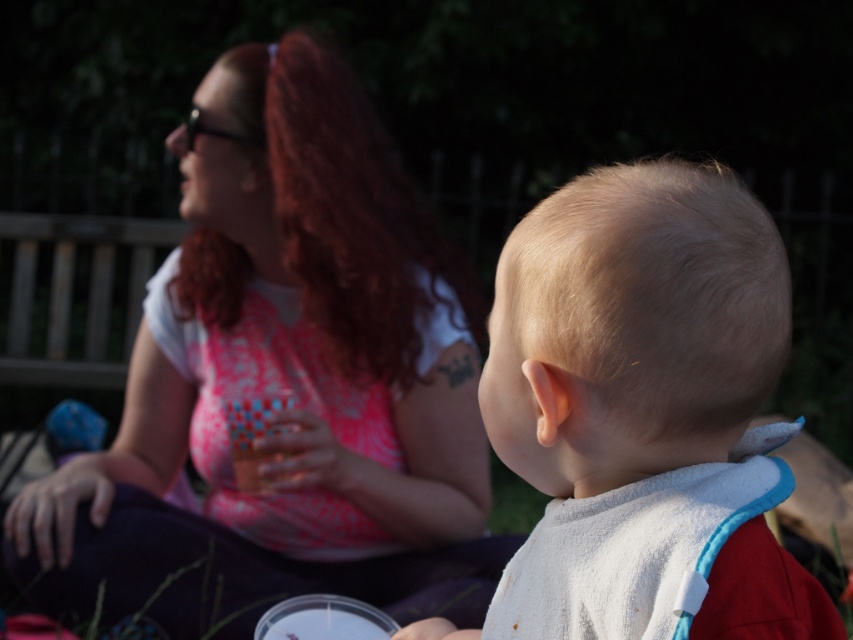
The image size is (853, 640). What do you see at coordinates (285, 381) in the screenshot?
I see `pink printed fabric at upper left` at bounding box center [285, 381].

Measure the distance between point (178, 602) and camera.

Point (178, 602) is 6.94 feet from camera.

Identify the location of pink printed fabric at upper left. This screenshot has height=640, width=853. (285, 381).

At what (x,y) coordinates should I click in order to perform the action: click on pink printed fabric at upper left. Please return your answer as a coordinate pair (x, y). Image resolution: width=853 pixels, height=640 pixels. Looking at the image, I should click on (285, 381).